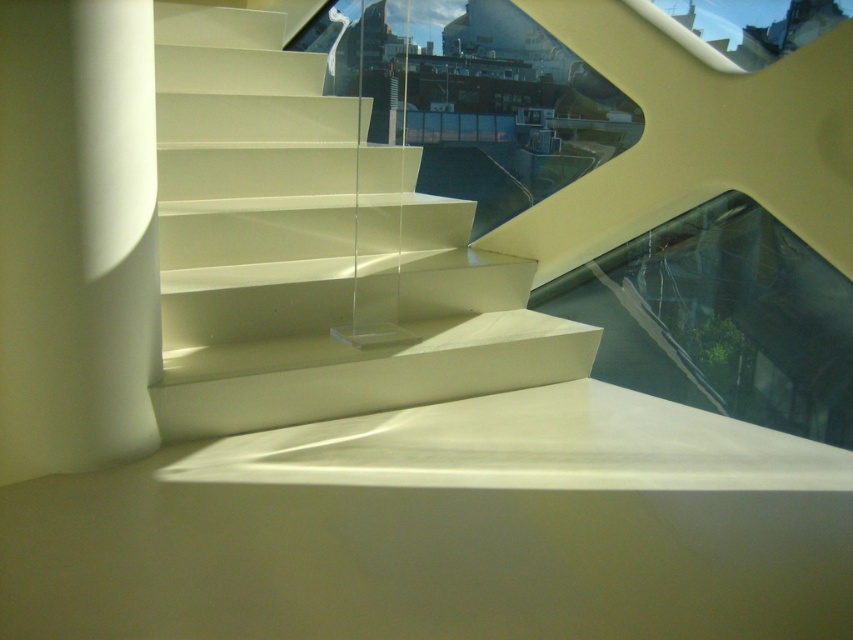
Does white glossy stairs at center have a lesser height compared to white matte pillar at left?

No.

Who is higher up, white glossy stairs at center or white matte pillar at left?

white glossy stairs at center is higher up.

You are a GUI agent. You are given a task and a screenshot of the screen. Output one action in this format:
    pyautogui.click(x=<x>, y=<y>)
    Task: Click on the white glossy stairs at center
    The height and width of the screenshot is (640, 853).
    Given the screenshot: What is the action you would take?
    pyautogui.click(x=315, y=250)